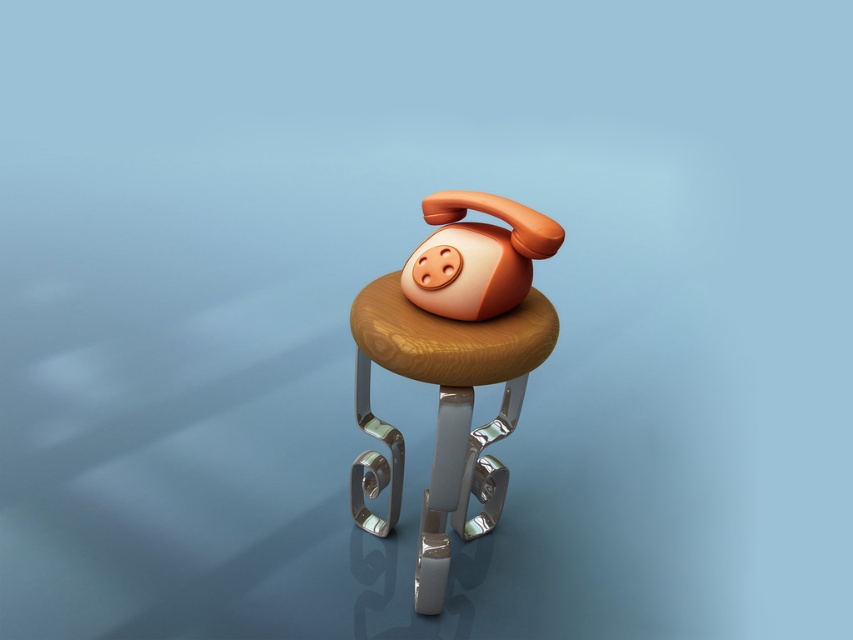
Who is more forward, (x=473, y=476) or (x=430, y=266)?

Point (x=430, y=266) is in front.

Which is above, woodenmaterial/texturestool at center or matte orange plastic piggy bank at center?

matte orange plastic piggy bank at center is above.

Who is more distant from viewer, (x=360, y=301) or (x=525, y=237)?

Positioned behind is point (x=360, y=301).

Image resolution: width=853 pixels, height=640 pixels. In order to click on woodenmaterial/texturestool at center in this screenshot , I will do `click(442, 413)`.